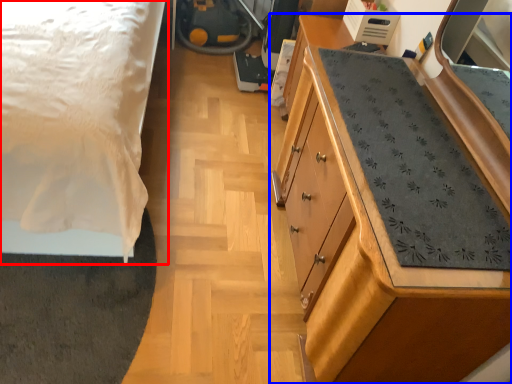
Question: Which of the following is the closest to the observer, bed (highlighted by a red box) or chest of drawers (highlighted by a blue box)?

Choices:
 (A) bed
 (B) chest of drawers

Answer: (A)